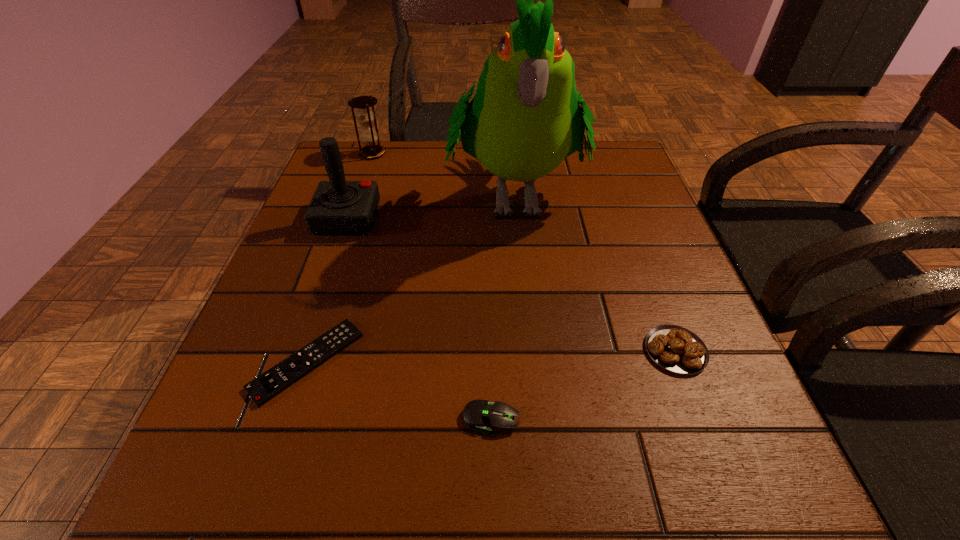
This screenshot has width=960, height=540. Identify the location of empty space that is in between the shortest object and the joystick. (327, 290).

At what (x,y) coordinates should I click in order to perform the action: click on free spot between the pastry and the fifth tallest object. Please return your answer as a coordinate pair (x, y). This screenshot has width=960, height=540. Looking at the image, I should click on (584, 384).

Find the location of a particular element. The height and width of the screenshot is (540, 960). empty space that is in between the pastry and the fourth shortest object is located at coordinates (524, 252).

Find the location of a particular element. free space between the rightmost object and the tallest object is located at coordinates (595, 273).

Identify the location of unoccupied position between the fifth tallest object and the second tallest object. (420, 319).

The image size is (960, 540). Identify the location of vacant area that lies between the rightmost object and the hourglass. (524, 252).

Identify the location of object that is the third closest to the fourth shortest object. The width and height of the screenshot is (960, 540). point(269,384).

Identify which object is the nearest to the fourth shortest object. Please provide its 2D coordinates. Your answer should be formatted as a tuple, i.e. [(x, y)], where the tuple contains the x and y coordinates of a point satisfying the conditions above.

[(524, 119)]

You are a GUI agent. You are given a task and a screenshot of the screen. Output one action in this format:
    pyautogui.click(x=<x>, y=<y>)
    Task: Click on the vacant space that satisfies the following two spatial constraints: 1. on the back side of the second shortest object; 2. on the base of the joystick
    This screenshot has width=960, height=540.
    Given the screenshot: What is the action you would take?
    pyautogui.click(x=488, y=219)

You are a GUI agent. You are given a task and a screenshot of the screen. Output one action in this format:
    pyautogui.click(x=<x>, y=<y>)
    Task: Click on the vacant space that satisfies the following two spatial constraints: 1. on the beak of the parakeet; 2. on the base of the second tallest object
    This screenshot has width=960, height=540.
    Given the screenshot: What is the action you would take?
    pyautogui.click(x=516, y=219)